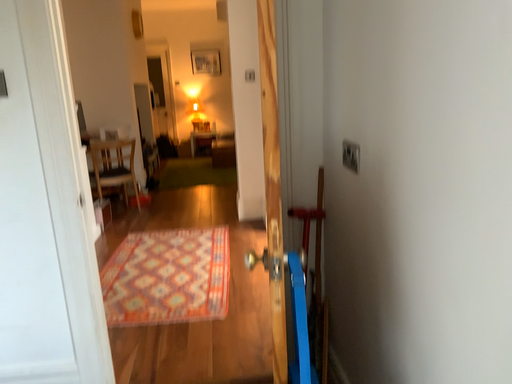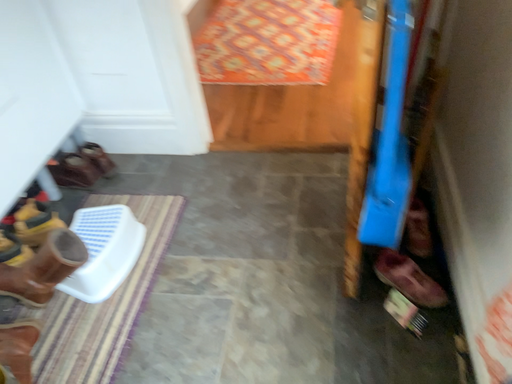
Question: How did the camera likely rotate when shooting the video?

Choices:
 (A) rotated left
 (B) rotated right

Answer: (A)